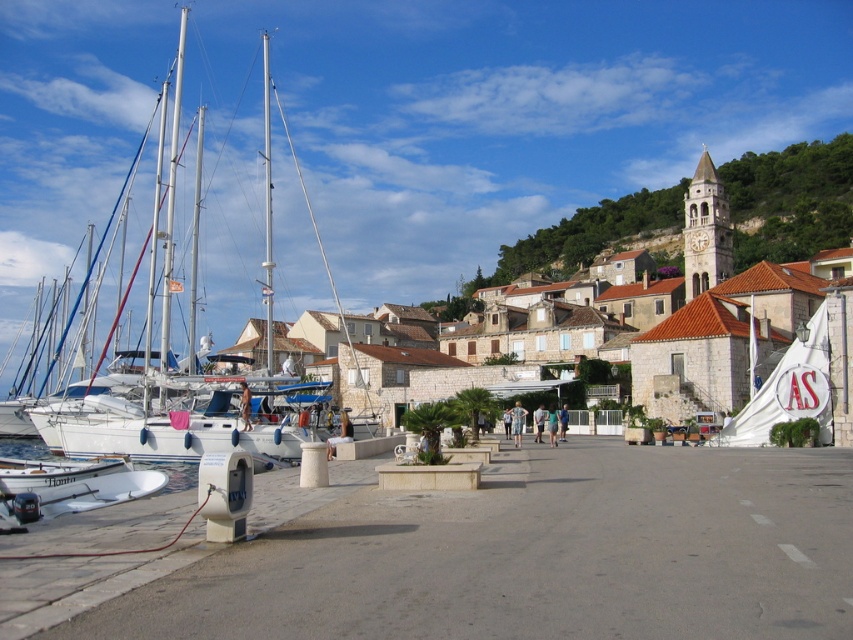
Question: Where is white glossy sailboat at left located in relation to white matte boat at lower left in the image?

Choices:
 (A) right
 (B) left

Answer: (B)

Question: Which object is closer to the camera taking this photo?

Choices:
 (A) white matte boat at lower left
 (B) stone clock tower at upper right

Answer: (A)

Question: Which point is closer to the camera taking this photo?

Choices:
 (A) (146, 208)
 (B) (45, 515)
 (C) (843, 163)

Answer: (B)

Question: Is white glossy sailboat at left thinner than stone clock tower at upper right?

Choices:
 (A) no
 (B) yes

Answer: (A)

Question: Is white glossy sailboat at left closer to camera compared to stone clock tower at upper right?

Choices:
 (A) no
 (B) yes

Answer: (B)

Question: Based on their relative distances, which object is farther from the stone clock tower at upper right?

Choices:
 (A) white glossy sailboat at left
 (B) white matte boat at lower left

Answer: (B)